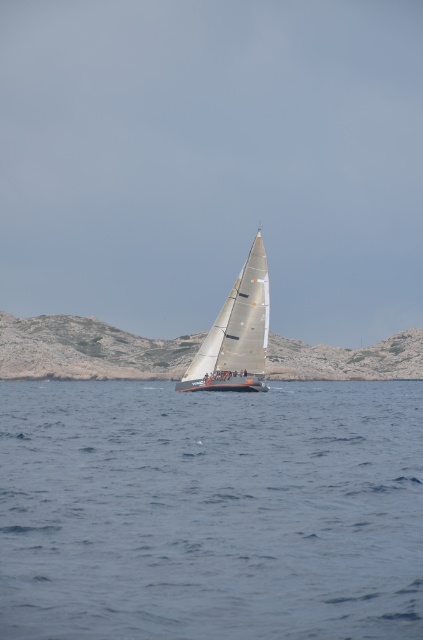
Consider the image. You are a sailor navigating a boat and see the blue water at center and the white matte sailboat at center. Which object is located to the right of the other?

The blue water at center is positioned on the left side of white matte sailboat at center, so the white matte sailboat at center is to the right of the blue water at center.

You are a sailor navigating a boat and need to determine the order of two points on your radar. The points are labeled as point 1 at coordinates point (381, 604) and point 2 at coordinates point (252, 244). Based on the scene, which point is closer to your boat?

Point 1 at coordinates point (381, 604) is closer to the boat because it is in front of point 2 at coordinates point (252, 244).

You are standing on the deck of the sailboat and want to know the color of the water directly below your feet. According to the image, what color is the water at point [211,512]?

The water at point [211,512] is blue.